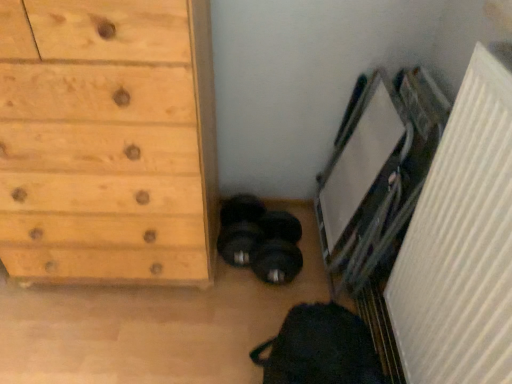
Question: Is white textured radiator at right bigger or smaller than natural wood chest of drawers at left?

Choices:
 (A) big
 (B) small

Answer: (B)

Question: From the image's perspective, relative to natural wood chest of drawers at left, is white textured radiator at right above or below?

Choices:
 (A) above
 (B) below

Answer: (B)

Question: Do you think white textured radiator at right is within natural wood chest of drawers at left, or outside of it?

Choices:
 (A) inside
 (B) outside

Answer: (B)

Question: From a real-world perspective, is natural wood chest of drawers at left positioned above or below white textured radiator at right?

Choices:
 (A) above
 (B) below

Answer: (B)

Question: Considering their positions, is natural wood chest of drawers at left located in front of or behind white textured radiator at right?

Choices:
 (A) front
 (B) behind

Answer: (B)

Question: Based on their positions, is natural wood chest of drawers at left located to the left or right of white textured radiator at right?

Choices:
 (A) left
 (B) right

Answer: (A)

Question: Do you think natural wood chest of drawers at left is within white textured radiator at right, or outside of it?

Choices:
 (A) outside
 (B) inside

Answer: (A)